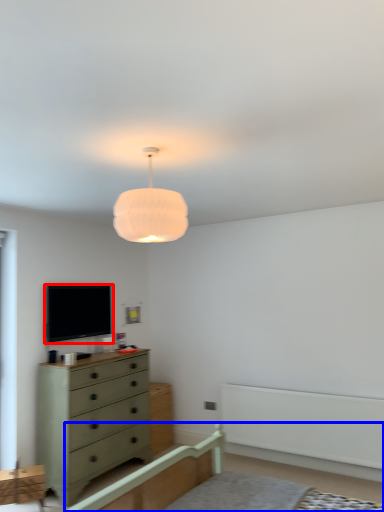
Question: Which object appears closest to the camera in this image, television (highlighted by a red box) or bed frame (highlighted by a blue box)?

Choices:
 (A) television
 (B) bed frame

Answer: (B)